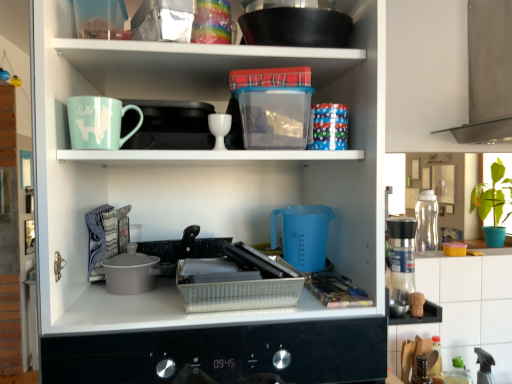
Question: Does white tile at upper right have a greater height compared to transparent plastic water bottle at right, which is counted as the 1th appliance, starting from the back?

Choices:
 (A) no
 (B) yes

Answer: (B)

Question: From a real-world perspective, is white tile at upper right under transparent plastic water bottle at right, which is counted as the 1th appliance, starting from the back?

Choices:
 (A) no
 (B) yes

Answer: (B)

Question: Would you say white tile at upper right contains transparent plastic water bottle at right, placed as the 2th appliance when sorted from front to back?

Choices:
 (A) no
 (B) yes

Answer: (A)

Question: Is white tile at upper right turned away from transparent plastic water bottle at right, which is counted as the 1th appliance, starting from the back?

Choices:
 (A) yes
 (B) no

Answer: (B)

Question: Is white tile at upper right facing towards transparent plastic water bottle at right, placed as the 2th appliance when sorted from left to right?

Choices:
 (A) yes
 (B) no

Answer: (B)

Question: Is black non-stick wok at upper center wider or thinner than matte ceramic mug at upper left?

Choices:
 (A) thin
 (B) wide

Answer: (B)

Question: Would you say black non-stick wok at upper center is inside or outside matte ceramic mug at upper left?

Choices:
 (A) outside
 (B) inside

Answer: (A)

Question: From a real-world perspective, relative to matte ceramic mug at upper left, is black non-stick wok at upper center vertically above or below?

Choices:
 (A) above
 (B) below

Answer: (A)

Question: Relative to matte ceramic mug at upper left, is black non-stick wok at upper center in front or behind?

Choices:
 (A) behind
 (B) front

Answer: (B)

Question: Would you say white tile at upper right is inside or outside white glossy egg cup at upper center?

Choices:
 (A) inside
 (B) outside

Answer: (B)

Question: Considering the relative positions of white tile at upper right and white glossy egg cup at upper center in the image provided, is white tile at upper right to the left or to the right of white glossy egg cup at upper center?

Choices:
 (A) left
 (B) right

Answer: (B)

Question: In terms of width, does white tile at upper right look wider or thinner when compared to white glossy egg cup at upper center?

Choices:
 (A) wide
 (B) thin

Answer: (B)

Question: Looking at the image, does white tile at upper right seem bigger or smaller compared to white glossy egg cup at upper center?

Choices:
 (A) big
 (B) small

Answer: (A)

Question: From the image's perspective, is blue plastic measuring cup at center positioned above or below black non-stick wok at upper center?

Choices:
 (A) above
 (B) below

Answer: (B)

Question: Looking at the image, does blue plastic measuring cup at center seem bigger or smaller compared to black non-stick wok at upper center?

Choices:
 (A) big
 (B) small

Answer: (A)